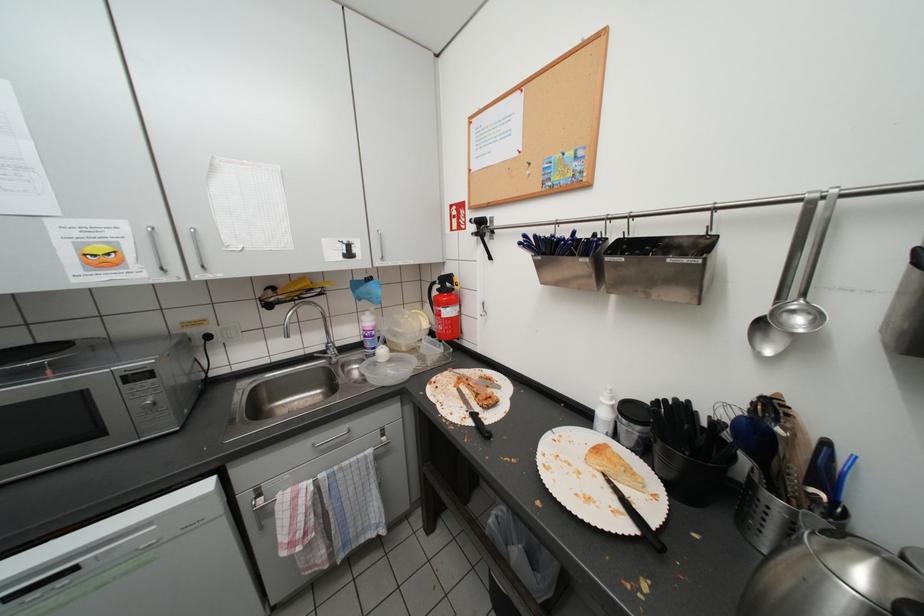
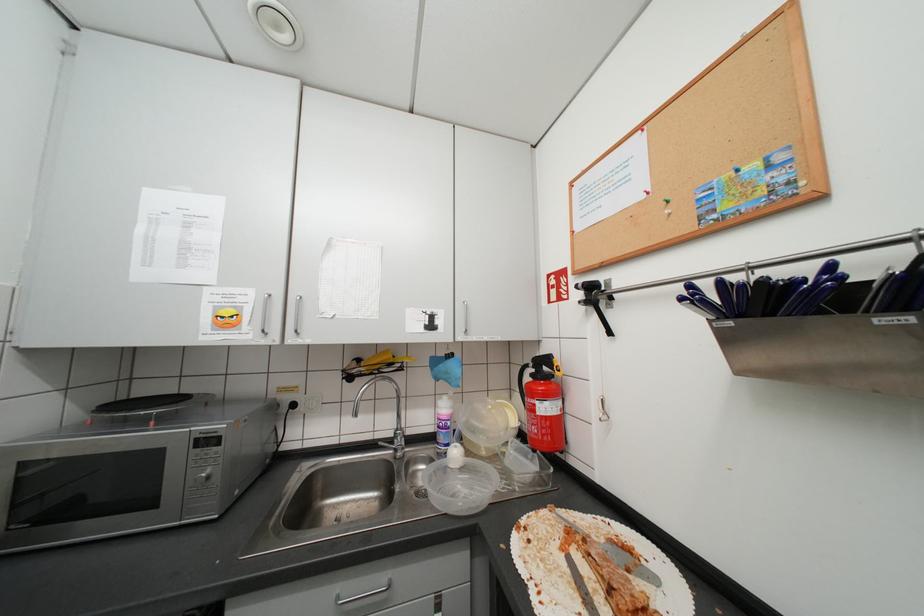
The images are taken continuously from a first-person perspective. In which direction is your viewpoint rotating?

The camera rotated toward left-up.